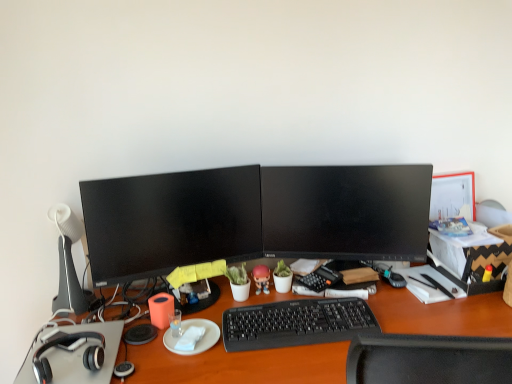
In order to click on vacant area that is in front of white paper at center in this screenshot , I will do `click(188, 366)`.